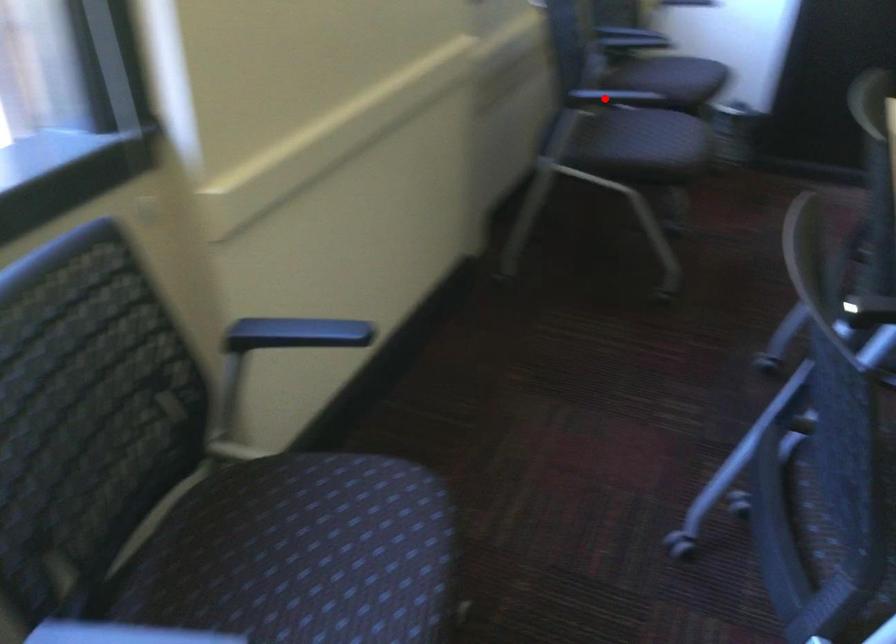
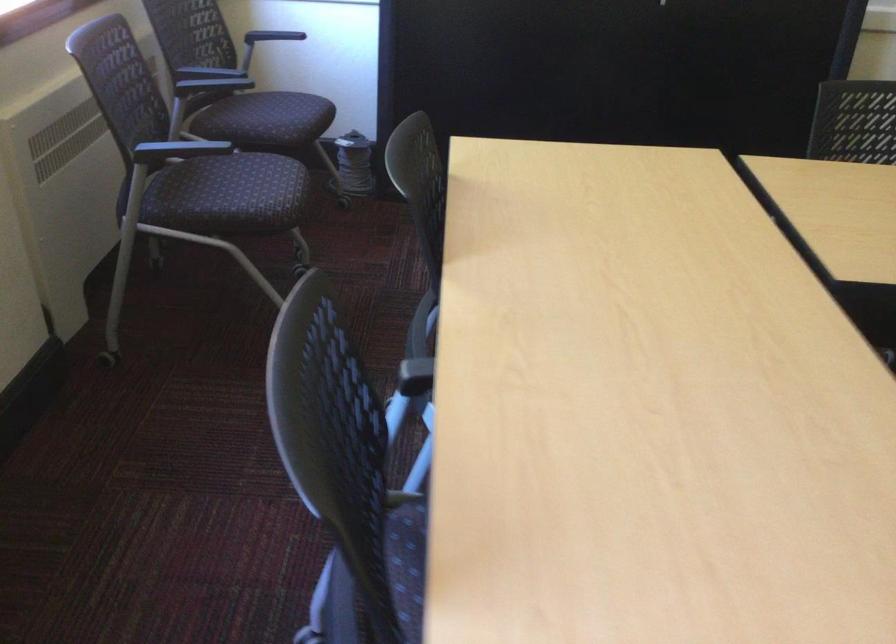
Question: I am providing you with two images of the same scene from different viewpoints. In image1, a red point is highlighted. Considering the same 3D point in image2, which of the following is correct?

Choices:
 (A) It is closer
 (B) It is farther

Answer: (A)